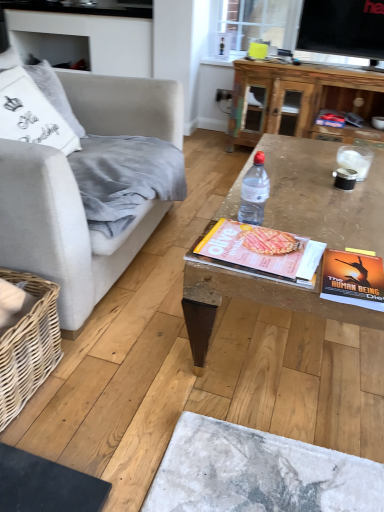
Identify the location of vacant area located to the right-hand side of clear plastic bottle at center. (302, 223).